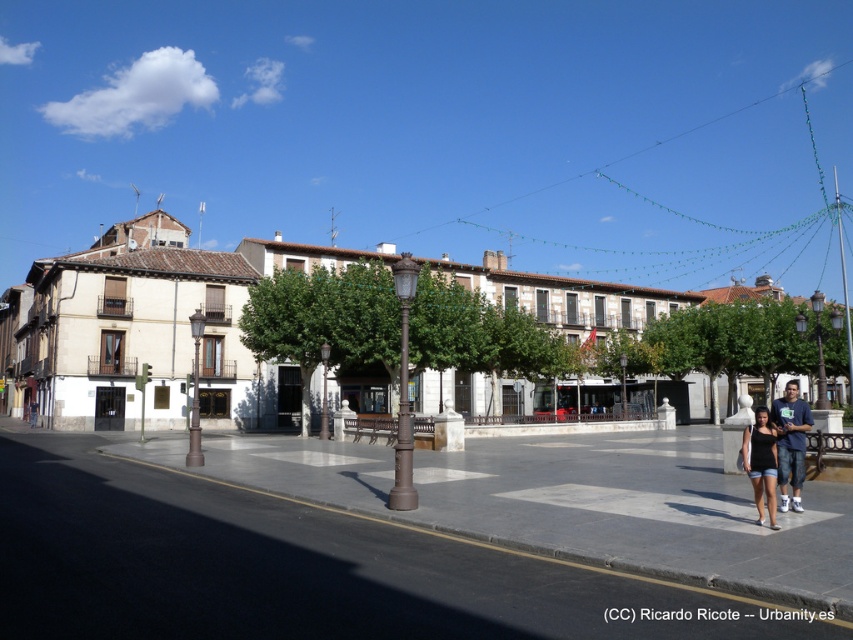
Who is taller, gray concrete pavement at center or matte black shorts at lower right?

With more height is matte black shorts at lower right.

Who is more distant from viewer, (488, 604) or (773, 488)?

The point (773, 488) is behind.

Which is in front, point (140, 588) or point (756, 496)?

Point (140, 588) is in front.

At what (x,y) coordinates should I click in order to perform the action: click on gray concrete pavement at center. Please return your answer as a coordinate pair (x, y). This screenshot has height=640, width=853. Looking at the image, I should click on (288, 566).

Is point (96, 552) farther from camera compared to point (0, 326)?

No, (96, 552) is in front of (0, 326).

Who is more distant from viewer, (590, 573) or (158, 221)?

Point (158, 221)

Is point (102, 481) less distant than point (38, 288)?

That is True.

At what (x,y) coordinates should I click in order to perform the action: click on gray concrete pavement at center. Please return your answer as a coordinate pair (x, y). The image size is (853, 640). Looking at the image, I should click on (288, 566).

Can you confirm if matte black t-shirt at lower right is thinner than matte black shorts at lower right?

Correct, matte black t-shirt at lower right's width is less than matte black shorts at lower right's.

Does matte black t-shirt at lower right appear over matte black shorts at lower right?

Yes, matte black t-shirt at lower right is above matte black shorts at lower right.

Identify the location of matte black t-shirt at lower right. (778, 451).